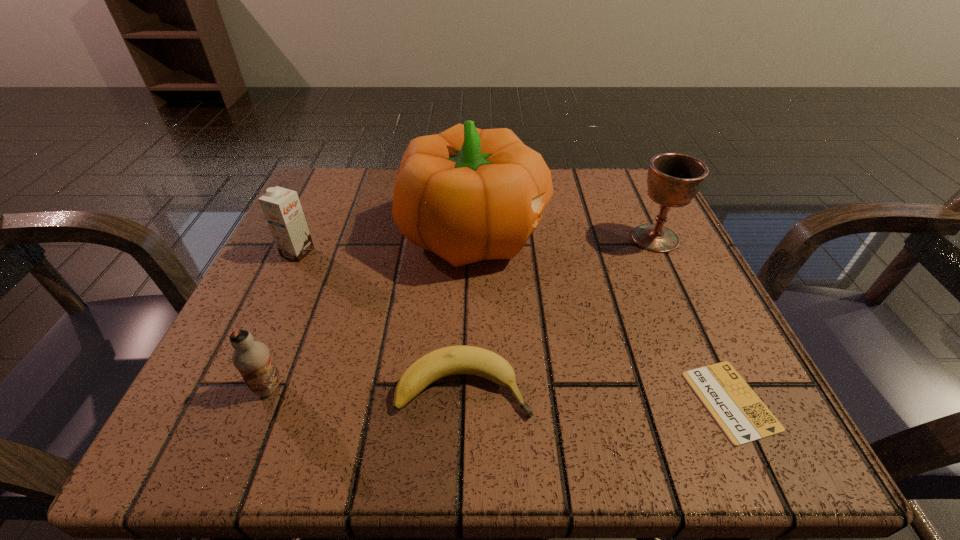
Where is `vacant space located 0.180m at the stem of the banana`? Image resolution: width=960 pixels, height=540 pixels. vacant space located 0.180m at the stem of the banana is located at coordinates (663, 388).

Identify the location of free region located 0.100m on the back of the identity card. The image size is (960, 540). (688, 310).

Locate an element on the screen. pumpkin located at the far edge is located at coordinates (466, 194).

I want to click on chalice that is at the far edge, so click(x=673, y=180).

In order to click on chocolate milk situated at the near edge in this screenshot , I will do `click(252, 358)`.

Locate an element on the screen. This screenshot has width=960, height=540. banana present at the near edge is located at coordinates (451, 360).

Locate an element on the screen. This screenshot has width=960, height=540. identity card that is at the near edge is located at coordinates (743, 417).

I want to click on chalice that is positioned at the right edge, so click(673, 180).

This screenshot has width=960, height=540. Identify the location of identity card that is at the right edge. (743, 417).

In order to click on object that is at the near left corner in this screenshot , I will do `click(252, 358)`.